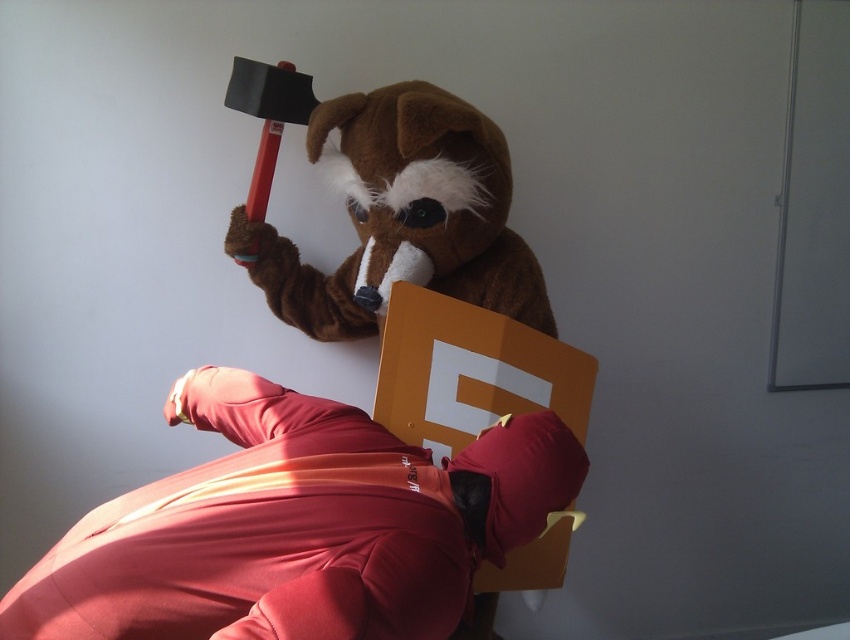
Is matte red tracksuit at center smaller than brown plush bear at upper center?

No.

Is matte red tracksuit at center above brown plush bear at upper center?

No.

At what (x,y) coordinates should I click in order to perform the action: click on matte red tracksuit at center. Please return your answer as a coordinate pair (x, y). This screenshot has height=640, width=850. Looking at the image, I should click on (298, 525).